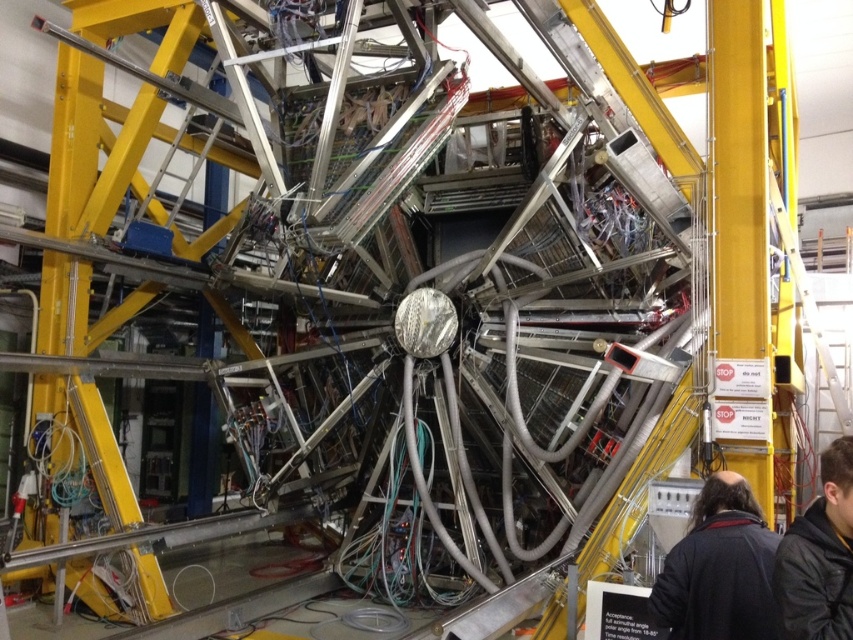
You are an engineer working in the facility and need to access the circular component in the center. There are two jackets, the dark brown leather jacket at lower right and the black jacket at lower right, blocking your path. Which jacket is shorter and easier to step over?

The dark brown leather jacket at lower right has a lesser height compared to the black jacket at lower right, so it is shorter and easier to step over.

You are an engineer inspecting the machinery and need to reach the circular component at the center. You have the option to use the yellow metallic ladder at left or climb over the black jacket at lower right. Which option would allow you to reach the component more safely?

The yellow metallic ladder at left is larger in size than the black jacket at lower right, so using the yellow metallic ladder at left would provide a safer and more stable way to reach the circular component at the center.